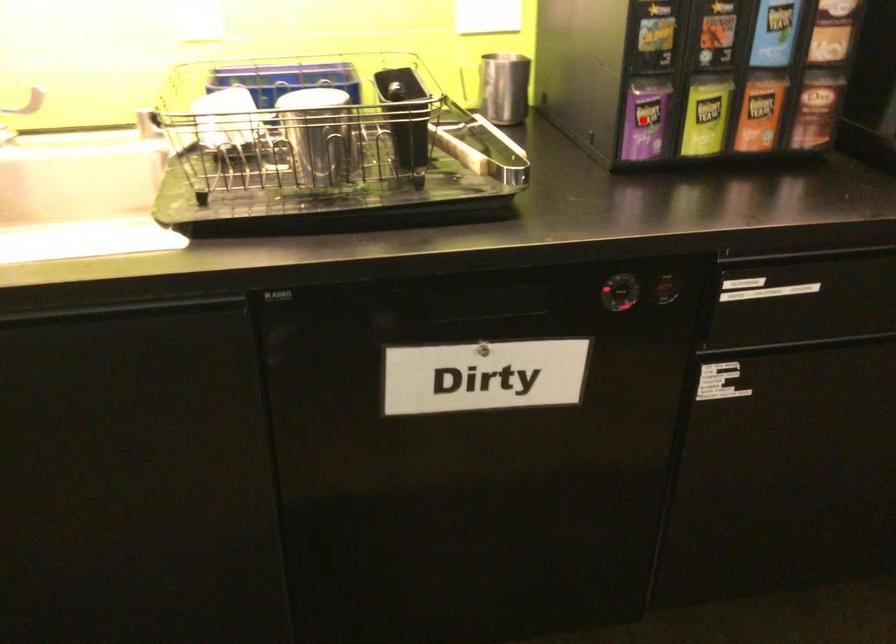
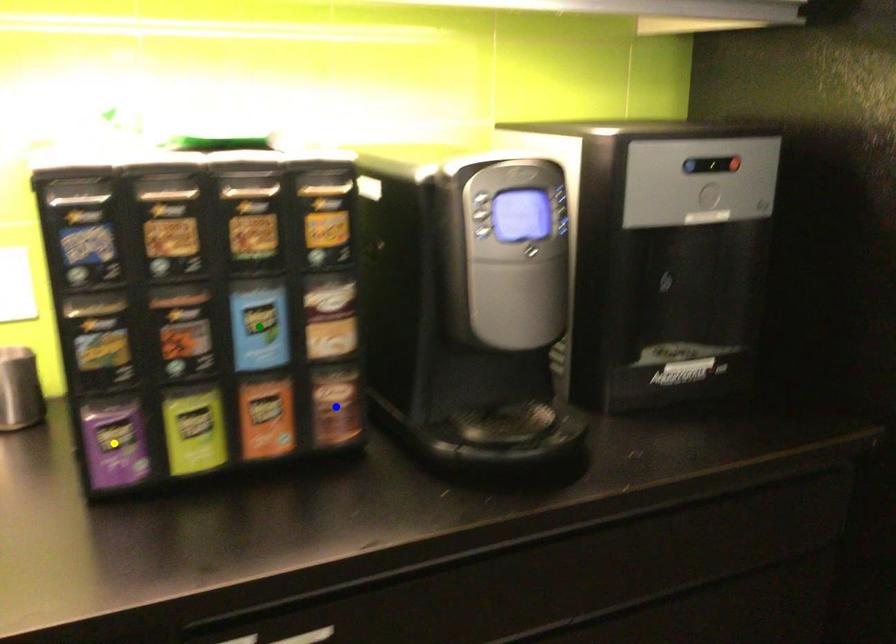
Question: I am providing you with two images of the same scene from different viewpoints. A red point is marked on the first image. You are given multiple points on the second image. In image 2, which mark is for the same physical point as the one in image 1?

Choices:
 (A) yellow point
 (B) green point
 (C) blue point

Answer: (A)